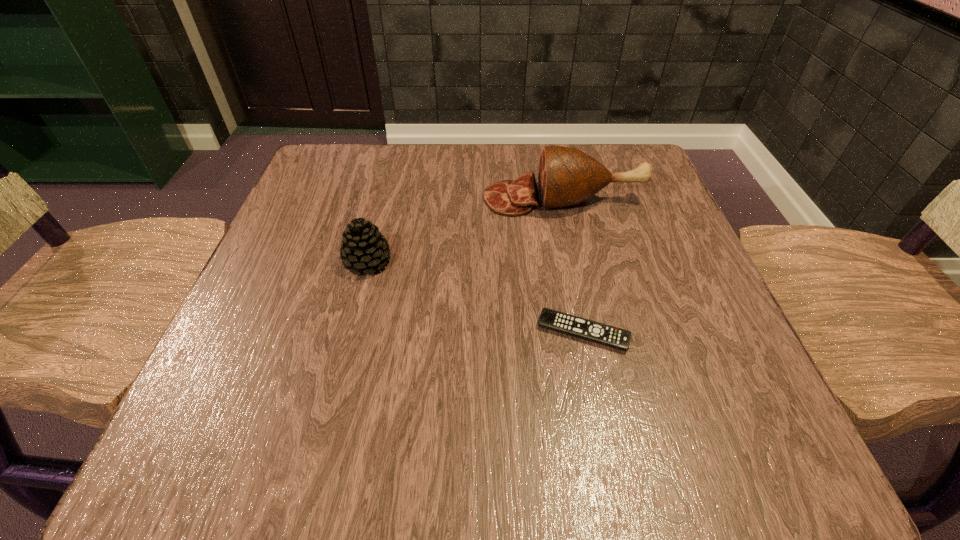
Where is `the farthest object`? This screenshot has height=540, width=960. the farthest object is located at coordinates (567, 176).

The width and height of the screenshot is (960, 540). Identify the location of pinecone. (363, 247).

The width and height of the screenshot is (960, 540). Identify the location of the leftmost object. (363, 247).

Where is `remote control`? This screenshot has width=960, height=540. remote control is located at coordinates (575, 326).

You are a GUI agent. You are given a task and a screenshot of the screen. Output one action in this format:
    pyautogui.click(x=<x>, y=<y>)
    Task: Click on the nearest object
    This screenshot has width=960, height=540.
    Given the screenshot: What is the action you would take?
    pyautogui.click(x=575, y=326)

The image size is (960, 540). Identify the location of vacant region located 0.180m at the sliced end of the farthest object. (397, 199).

Locate an element on the screen. blank space located 0.350m at the sliced end of the farthest object is located at coordinates (315, 199).

The height and width of the screenshot is (540, 960). I want to click on vacant area situated 0.060m at the sliced end of the farthest object, so click(x=455, y=199).

Identify the location of free region located at the narrow end of the leftmost object. This screenshot has height=540, width=960. (453, 262).

Where is `free spot located on the left of the shortest object`? This screenshot has height=540, width=960. free spot located on the left of the shortest object is located at coordinates (440, 332).